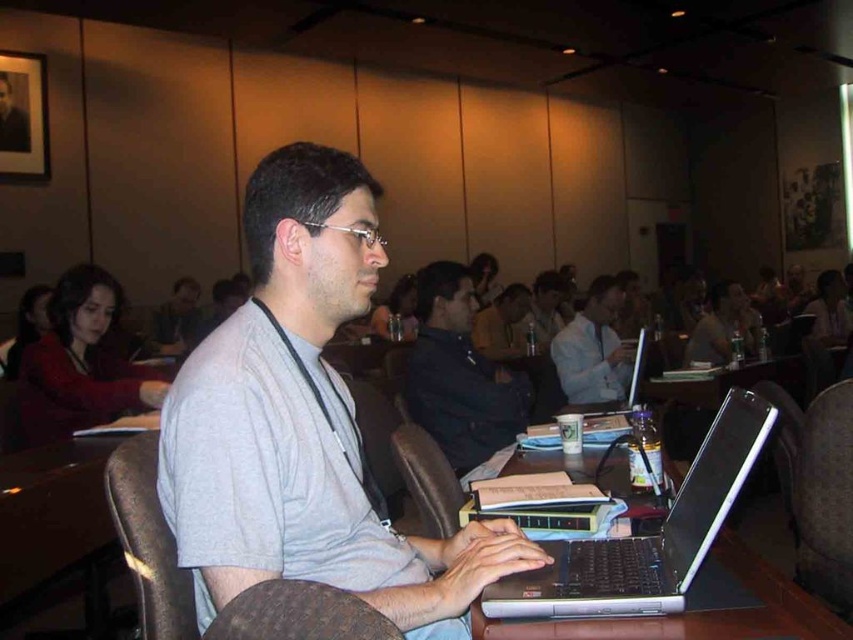
You are standing in the room and want to locate the matte red shirt at upper left. Based on the coordinates provided, where would you look?

The matte red shirt at upper left is located at the coordinates point (80, 364).

From the picture: You are a participant at a conference and see the image. You need to locate the exact location of the laptop. Where is the point at coordinates (645, 536) located on the laptop?

The point at coordinates (645, 536) is located on the silver or black plastic laptop at center.